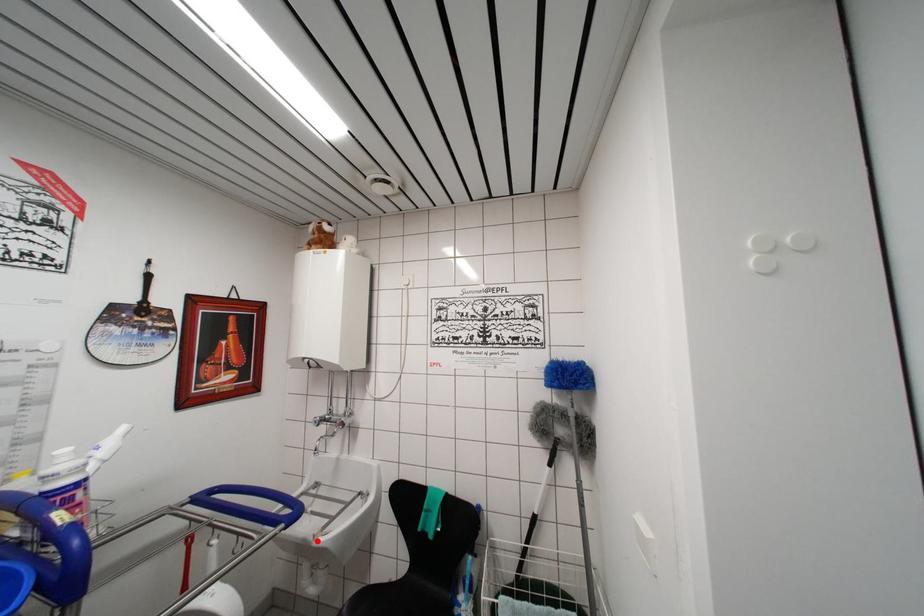
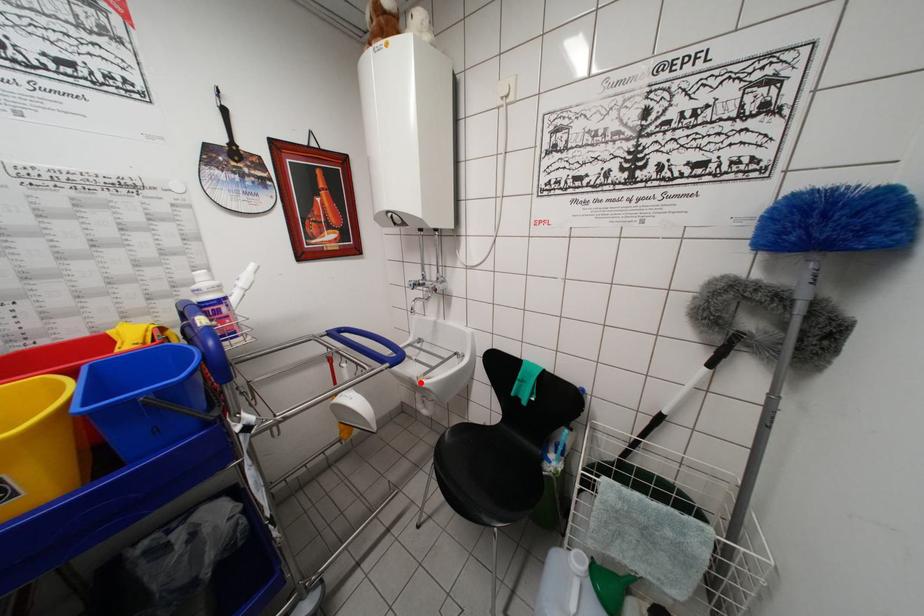
I am providing you with two images of the same scene from different viewpoints. A red point is marked on the first image and another point is marked on the second image. Is the red point in image1 aligned with the point shown in image2?

Yes